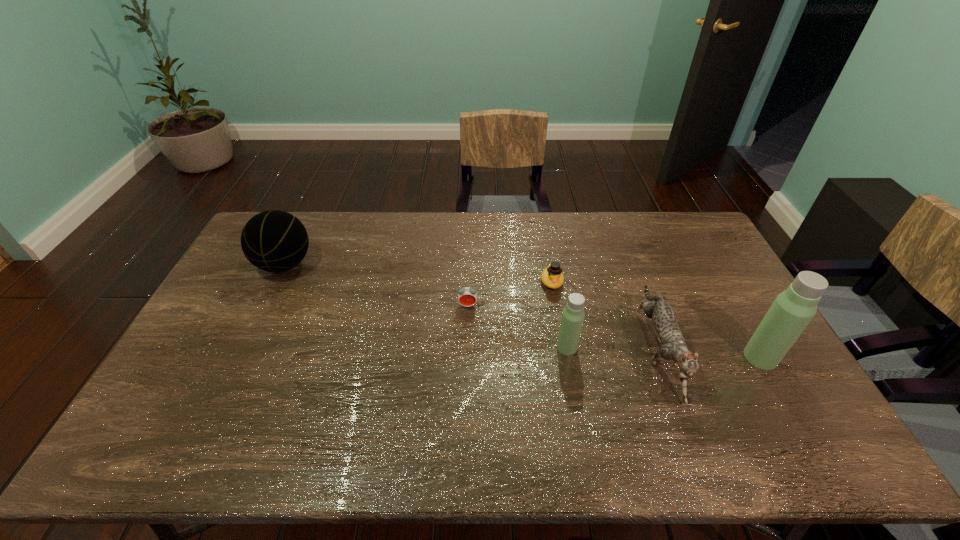
This screenshot has width=960, height=540. I want to click on object that is the nearest to the duck, so click(x=573, y=315).

The height and width of the screenshot is (540, 960). I want to click on the third closest object to the basketball, so tap(573, 315).

Identify the location of free spot that satisfies the following two spatial constraints: 1. on the face of the fifth object from right to left; 2. on the right side of the shorter thermos bottle. The height and width of the screenshot is (540, 960). (467, 347).

Identify the location of blank space that satisfies the following two spatial constraints: 1. on the front-facing side of the tallest object; 2. on the right side of the duck. (564, 357).

This screenshot has height=540, width=960. Find the location of `vacant space that satisfies the following two spatial constraints: 1. on the face of the right thermos bottle; 2. on the left side of the alarm clock`. vacant space that satisfies the following two spatial constraints: 1. on the face of the right thermos bottle; 2. on the left side of the alarm clock is located at coordinates (467, 357).

Where is `free space that satisfies the following two spatial constraints: 1. on the front-facing side of the left thermos bottle; 2. on the left side of the duck`? free space that satisfies the following two spatial constraints: 1. on the front-facing side of the left thermos bottle; 2. on the left side of the duck is located at coordinates (563, 347).

This screenshot has height=540, width=960. In order to click on free point that satisfies the following two spatial constraints: 1. on the face of the taller thermos bottle; 2. on the left side of the fourth tallest object in this screenshot , I will do `click(659, 357)`.

Where is `vacant region that satisfies the following two spatial constraints: 1. on the front side of the shorter thermos bottle; 2. on the right side of the tallest object`? vacant region that satisfies the following two spatial constraints: 1. on the front side of the shorter thermos bottle; 2. on the right side of the tallest object is located at coordinates (568, 357).